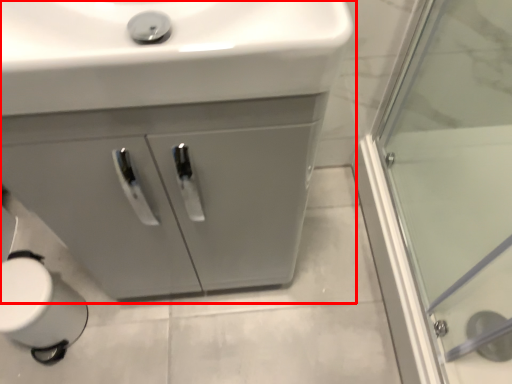
Question: From the image, what is the correct spatial relationship of bathroom cabinet (annotated by the red box) in relation to sink?

Choices:
 (A) left
 (B) right

Answer: (B)